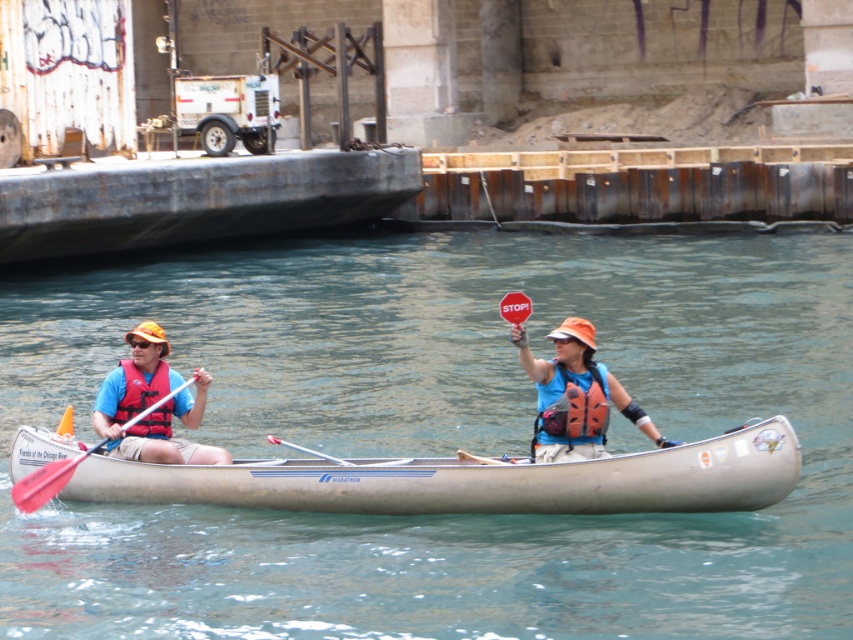
You are a safety inspector checking the canoe. You notice the orange life vest at center and the red plastic paddle at left. According to safety regulations, life vests must be larger than paddles for easy visibility. Does the current setup comply with the regulations?

The orange life vest at center is smaller than the red plastic paddle at left, so it does not comply with the safety regulations requiring life vests to be larger than paddles for easy visibility.

Looking at this image, you are a safety inspector checking the canoe. According to the image, is the orange life vest at center properly placed over the red plastic paddle at left?

Yes, the orange life vest at center is positioned over the red plastic paddle at left, so it is properly placed.